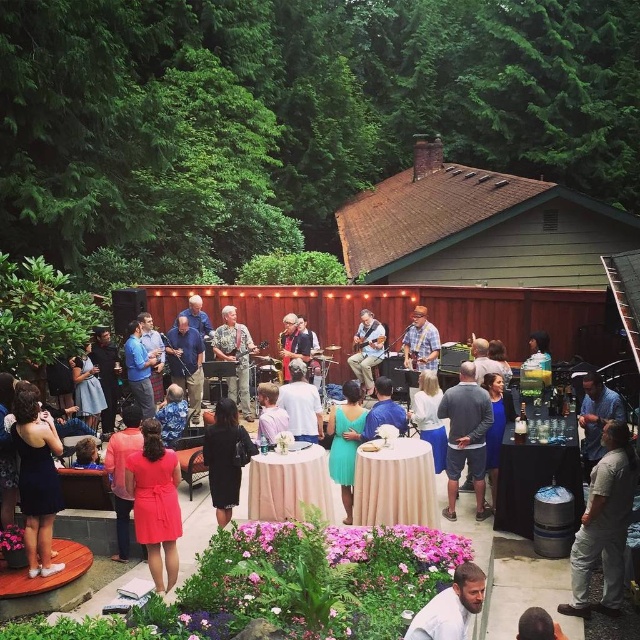
Question: Can you confirm if khaki cotton shirt at center is positioned to the right of pink fabric dress at center?

Choices:
 (A) no
 (B) yes

Answer: (A)

Question: Which point is closer to the camera taking this photo?

Choices:
 (A) (120, 438)
 (B) (358, 310)

Answer: (A)

Question: Can you confirm if matte red dress at center is bigger than blue shirt at center?

Choices:
 (A) no
 (B) yes

Answer: (A)

Question: Which object is the closest to the matte red dress at center?

Choices:
 (A) matte black dress at lower left
 (B) blue fabric shirt at center
 (C) matte brown guitar at center
 (D) white cotton shirt at center

Answer: (A)

Question: Can you confirm if black fabric table at lower right is wider than beige fabric table at center?

Choices:
 (A) no
 (B) yes

Answer: (B)

Question: Which of the following is the farthest from the observer?

Choices:
 (A) gray cotton t-shirt at lower right
 (B) matte black dress at lower left

Answer: (B)